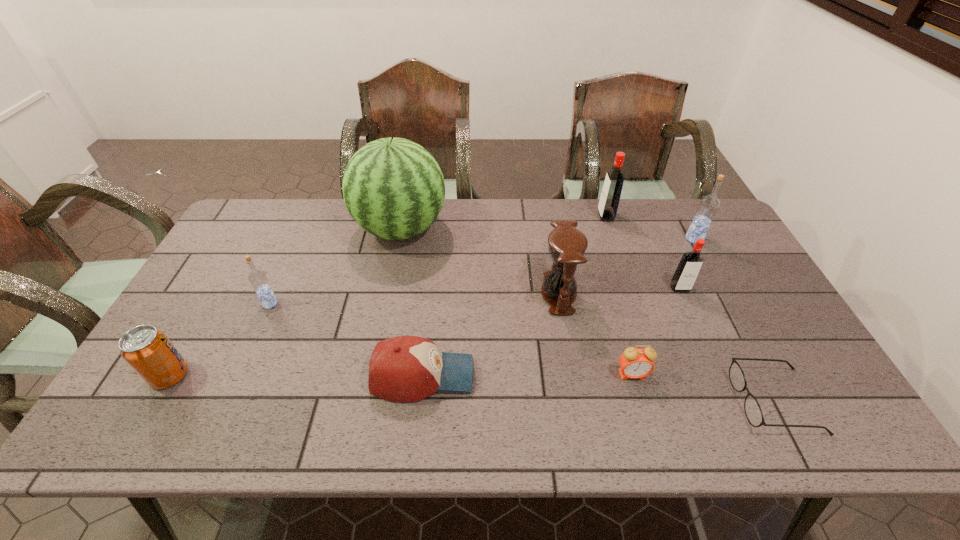
Identify the location of free location located on the front-facing side of the spectacles. (622, 401).

Identify the location of vacant space located 0.240m on the front-facing side of the spectacles. (636, 401).

Where is `watermelon that is positioned at the far edge`? The height and width of the screenshot is (540, 960). watermelon that is positioned at the far edge is located at coordinates (393, 188).

Identify the location of object situated at the near edge. (753, 412).

I want to click on object situated at the left edge, so click(x=147, y=350).

What are the coordinates of `vodka present at the right edge` in the screenshot? It's located at (708, 205).

Where is `spectacles positioned at the right edge`? The width and height of the screenshot is (960, 540). spectacles positioned at the right edge is located at coordinates (753, 412).

Where is `object located in the far right corner section of the desktop`? object located in the far right corner section of the desktop is located at coordinates (708, 205).

You are a GUI agent. You are given a task and a screenshot of the screen. Output one action in this format:
    pyautogui.click(x=<x>, y=<y>)
    Task: Click on the object located at the near right corner
    
    Given the screenshot: What is the action you would take?
    pyautogui.click(x=753, y=412)

This screenshot has height=540, width=960. Identify the location of blank area at the far edge. (478, 221).